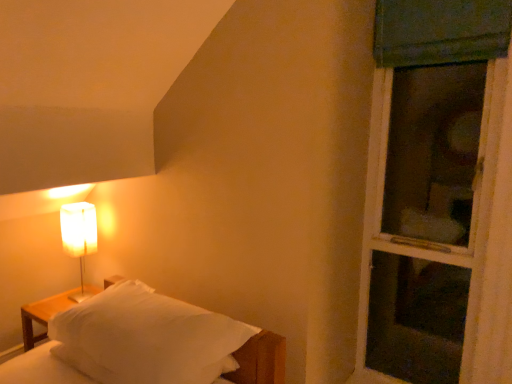
What do you see at coordinates (438, 228) in the screenshot? I see `green fabric screen door at right` at bounding box center [438, 228].

Identify the location of white soft bed at lower left. (146, 344).

At what (x,y) coordinates should I click in order to perform the action: click on green fabric screen door at right. Please return your answer as a coordinate pair (x, y). Image resolution: width=512 pixels, height=384 pixels. Looking at the image, I should click on (438, 228).

Between point (167, 355) and point (78, 252), which one is positioned behind?

Positioned behind is point (78, 252).

Between white soft bed at lower left and white paper lampshade at left, which one has smaller width?

Thinner between the two is white paper lampshade at left.

From a real-world perspective, is white soft bed at lower left positioned above or below white paper lampshade at left?

Clearly, from a real-world perspective, white soft bed at lower left is below white paper lampshade at left.

Is white soft bed at lower left aimed at white paper lampshade at left?

No.

Can you see white paper lampshade at left touching white soft bed at lower left?

No, white paper lampshade at left is not touching white soft bed at lower left.

How many degrees apart are the facing directions of white paper lampshade at left and white soft bed at lower left?

The angular difference between white paper lampshade at left and white soft bed at lower left is 162 degrees.

In terms of height, does white paper lampshade at left look taller or shorter compared to white soft bed at lower left?

Clearly, white paper lampshade at left is taller compared to white soft bed at lower left.

Is white paper lampshade at left to the left or to the right of white soft bed at lower left in the image?

white paper lampshade at left is to the left of white soft bed at lower left.

Considering the sizes of objects white paper lampshade at left and green fabric screen door at right in the image provided, who is wider, white paper lampshade at left or green fabric screen door at right?

green fabric screen door at right is wider.

Does white paper lampshade at left turn towards green fabric screen door at right?

No.

What's the angular difference between white paper lampshade at left and green fabric screen door at right's facing directions?

0.267 degrees.

Find the location of a particular element. The image size is (512, 384). screen door in front of the white paper lampshade at left is located at coordinates (x=438, y=228).

Is green fabric screen door at right looking in the opposite direction of white soft bed at lower left?

No, white soft bed at lower left is not at the back of green fabric screen door at right.

Identify the location of screen door behind the white soft bed at lower left. (438, 228).

Which of these two, green fabric screen door at right or white soft bed at lower left, stands shorter?

Standing shorter between the two is white soft bed at lower left.

Which object is thinner, green fabric screen door at right or white soft bed at lower left?

With smaller width is green fabric screen door at right.

From a real-world perspective, which is physically below, green fabric screen door at right or white paper lampshade at left?

white paper lampshade at left is physically lower.

From the picture: Can you confirm if green fabric screen door at right is bigger than white paper lampshade at left?

Indeed, green fabric screen door at right has a larger size compared to white paper lampshade at left.

From the image's perspective, which is below, green fabric screen door at right or white paper lampshade at left?

From the image's view, white paper lampshade at left is below.

Which of these two, green fabric screen door at right or white paper lampshade at left, is thinner?

Thinner between the two is white paper lampshade at left.

From a real-world perspective, which is physically above, white soft bed at lower left or green fabric screen door at right?

green fabric screen door at right is physically above.

Would you say white soft bed at lower left is a long distance from green fabric screen door at right?

Yes, white soft bed at lower left is far from green fabric screen door at right.

Is the position of white soft bed at lower left more distant than that of green fabric screen door at right?

No, white soft bed at lower left is closer to the viewer.

Image resolution: width=512 pixels, height=384 pixels. Identify the location of lamp that is above the white soft bed at lower left (from a real-world perspective). (79, 236).

What are the coordinates of `lamp on the left side of white soft bed at lower left` in the screenshot? It's located at (79, 236).

From the image, which object appears to be farther from green fabric screen door at right, white soft bed at lower left or white paper lampshade at left?

white paper lampshade at left lies further to green fabric screen door at right than the other object.

Considering their positions, is white soft bed at lower left positioned closer to white paper lampshade at left than green fabric screen door at right?

Based on the image, white soft bed at lower left appears to be nearer to white paper lampshade at left.

Consider the image. Considering their positions, is green fabric screen door at right positioned closer to white paper lampshade at left than white soft bed at lower left?

Based on the image, white soft bed at lower left appears to be nearer to white paper lampshade at left.

Looking at the image, which one is located further to green fabric screen door at right, white paper lampshade at left or white soft bed at lower left?

white paper lampshade at left is positioned further to the anchor green fabric screen door at right.

Estimate the real-world distances between objects in this image. Which object is closer to white soft bed at lower left, white paper lampshade at left or green fabric screen door at right?

white paper lampshade at left is positioned closer to the anchor white soft bed at lower left.

From the image, which object appears to be nearer to white soft bed at lower left, green fabric screen door at right or white paper lampshade at left?

white paper lampshade at left.

The image size is (512, 384). What are the coordinates of `bed between white paper lampshade at left and green fabric screen door at right in the horizontal direction` in the screenshot? It's located at (146, 344).